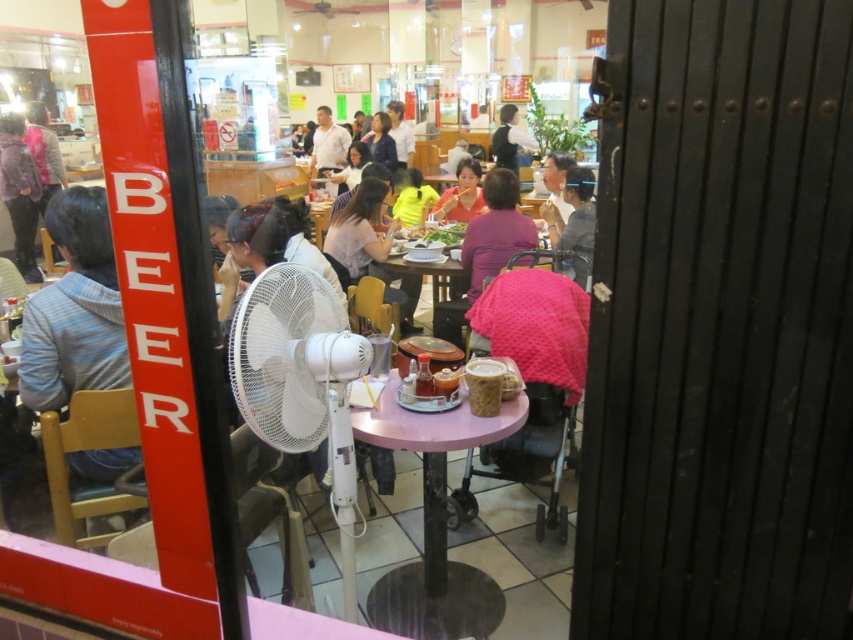
You are standing outside the restaurant looking through the window. You see a striped sweater at left and a dark blue shirt at center. If you want to take a photo of both items in the same frame, will you need to zoom in or out?

The striped sweater at left is 19.32 feet from the dark blue shirt at center. To capture both in the same frame, you would need to zoom out since they are far apart.

You are a customer entering the restaurant and see the matte black jacket at left and the white matte shirt at center. Which clothing item is located more to the left side of the scene?

The matte black jacket at left is positioned on the left side of the white matte shirt at center, so it is more to the left.

Based on the photo, you are looking through the restaurant window and see two points marked on the glass. The first point is at coordinate (451, 188) and the second at (329, 141). Which point is closer to your eyes?

Point (451, 188) is closer to the camera than point (329, 141), so the first point is closer to your eyes.